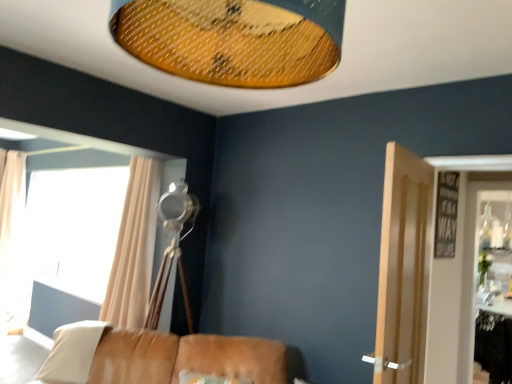
Question: Considering the positions of white fabric pillow at lower left and light brown wooden door at right in the image, is white fabric pillow at lower left taller or shorter than light brown wooden door at right?

Choices:
 (A) short
 (B) tall

Answer: (A)

Question: Would you say white fabric pillow at lower left is inside or outside light brown wooden door at right?

Choices:
 (A) inside
 (B) outside

Answer: (B)

Question: Estimate the real-world distances between objects in this image. Which object is farther from the beige fabric curtain at left, which ranks as the first curtain in left-to-right order?

Choices:
 (A) beige fabric curtain at left, which appears as the 2th curtain when viewed from the left
 (B) matte orange mesh lampshade at upper center
 (C) black glass table at lower right
 (D) leather couch at lower center
 (E) white fabric pillow at lower left

Answer: (C)

Question: Which is farther from the light brown wooden door at right?

Choices:
 (A) leather couch at lower center
 (B) beige fabric curtain at left, which appears as the 1th curtain when viewed from the back
 (C) beige fabric curtain at left, which appears as the 2th curtain when viewed from the left
 (D) white fabric pillow at lower left
 (E) black glass table at lower right

Answer: (B)